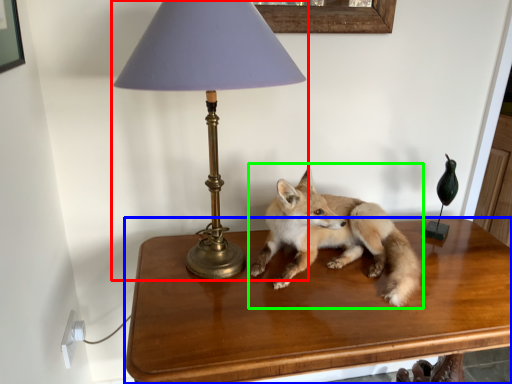
Question: Considering the real-world distances, which object is farthest from lamp (highlighted by a red box)? table (highlighted by a blue box) or fox (highlighted by a green box)?

Choices:
 (A) table
 (B) fox

Answer: (A)